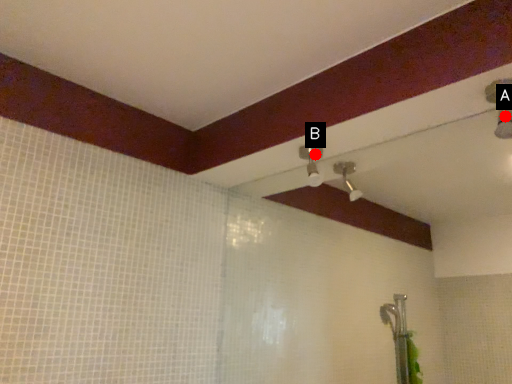
Question: Two points are circled on the image, labeled by A and B beside each circle. Which point is closer to the camera?

Choices:
 (A) A is closer
 (B) B is closer

Answer: (A)